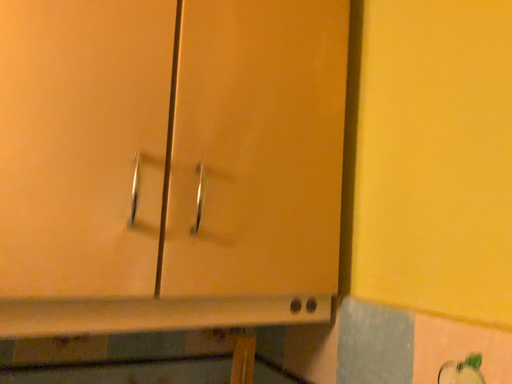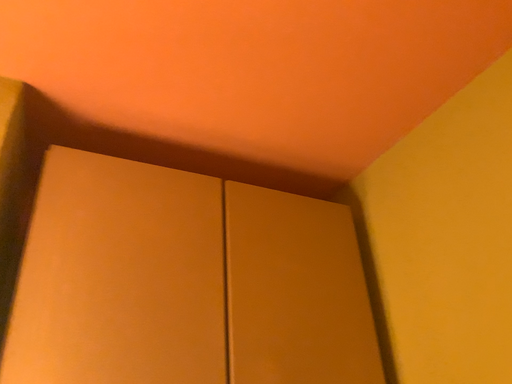
Question: Which way did the camera rotate in the video?

Choices:
 (A) rotated downward
 (B) rotated upward

Answer: (B)